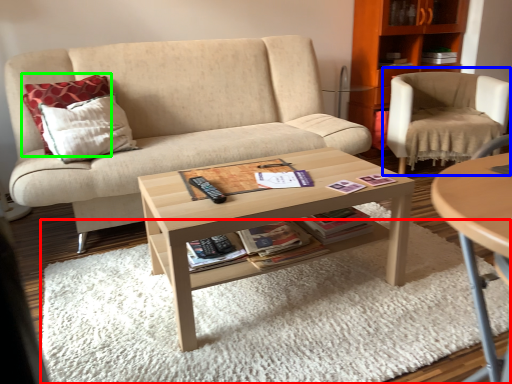
Question: Which object is positioned farthest from plain (highlighted by a red box)? Select from chair (highlighted by a blue box) and pillow (highlighted by a green box).

Choices:
 (A) chair
 (B) pillow

Answer: (A)